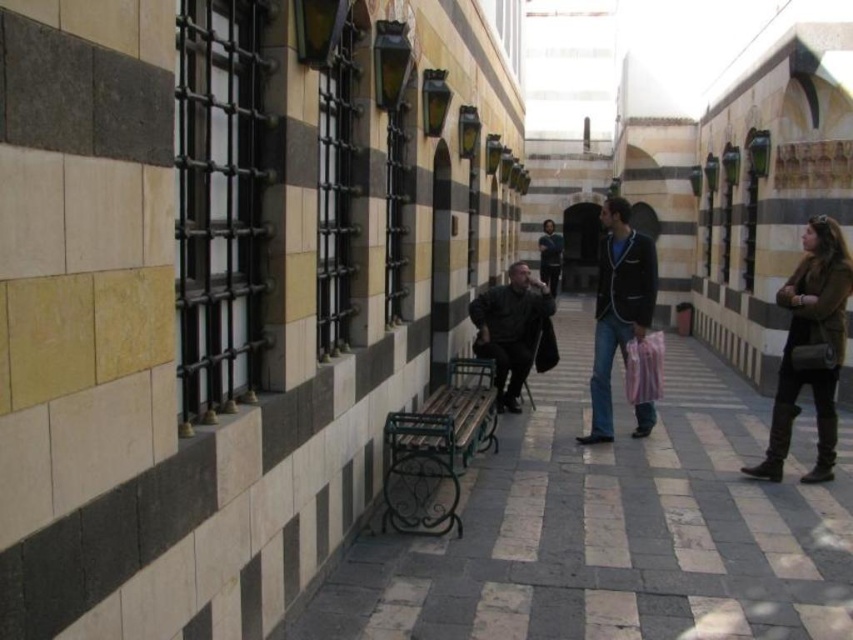
You are a delivery person trying to place a large package in the courtyard. The package is 1.2 meters wide. You see the blue denim jeans at center and the dark blue jacket at center. Can the package fit between these two items without overlapping them?

The blue denim jeans at center might be wider than dark blue jacket at center, but since the exact width isn t specified, it s uncertain if the 1.2 meter package can fit between them. Check the actual dimensions before placing the package.

You are standing in the courtyard and want to place a small potted plant between the two points, point (641, 237) and point (556, 234). Based on their positions, which point should the plant be closer to in order to be in front of the other point?

The plant should be closer to point (641, 237) because it is in front of point (556, 234).

You are standing at the entrance of the courtyard and see a person sitting on the green metal bench against the left wall. Where is the point located at coordinates (618, 307) in relation to the person?

The point at coordinates (618, 307) is located on the blue denim jeans at center, which is part of the person sitting on the green metal bench against the left wall.